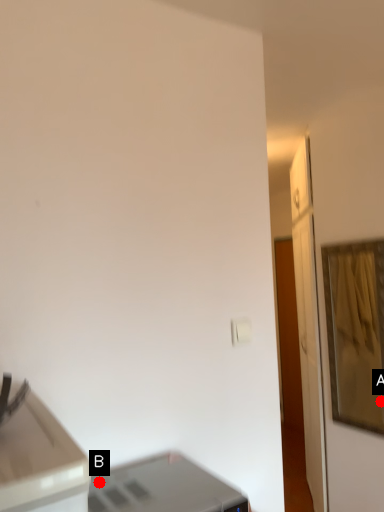
Question: Two points are circled on the image, labeled by A and B beside each circle. Which point is closer to the camera?

Choices:
 (A) A is closer
 (B) B is closer

Answer: (B)